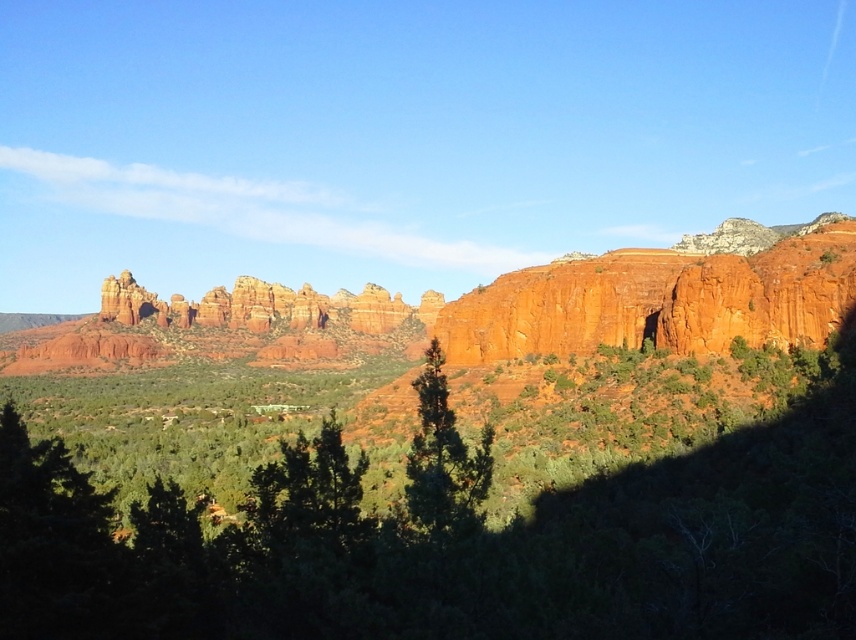
Who is positioned more to the right, reddish-brown rock formation at center or green matte tree at center?

→ green matte tree at center

Measure the distance between point (599, 273) and camera.

Point (599, 273) is 100.57 meters away from camera.

Measure the distance between point (116, 358) and camera.

The distance of point (116, 358) from camera is 194.98 meters.

Find the location of a particular element. The width and height of the screenshot is (856, 640). reddish-brown rock formation at center is located at coordinates (479, 310).

Can you confirm if green leafy tree at center is taller than reddish-brown rock formation at center?

No, green leafy tree at center is not taller than reddish-brown rock formation at center.

Image resolution: width=856 pixels, height=640 pixels. Describe the element at coordinates (455, 541) in the screenshot. I see `green leafy tree at center` at that location.

The height and width of the screenshot is (640, 856). What do you see at coordinates (455, 541) in the screenshot?
I see `green leafy tree at center` at bounding box center [455, 541].

The height and width of the screenshot is (640, 856). Identify the location of green leafy tree at center. (455, 541).

Who is shorter, reddish-brown rock formation at center or rustic sandstone rock formation at center?

rustic sandstone rock formation at center

Between reddish-brown rock formation at center and rustic sandstone rock formation at center, which one is positioned lower?

reddish-brown rock formation at center

What do you see at coordinates (479, 310) in the screenshot? I see `reddish-brown rock formation at center` at bounding box center [479, 310].

Find the location of a particular element. reddish-brown rock formation at center is located at coordinates (479, 310).